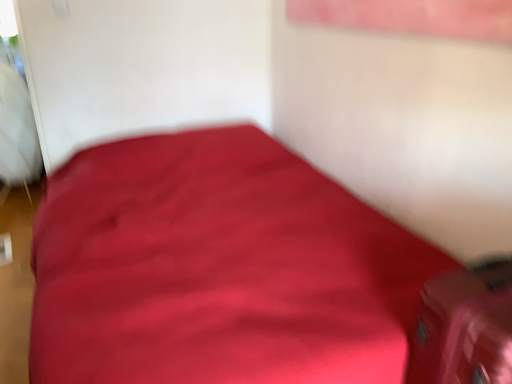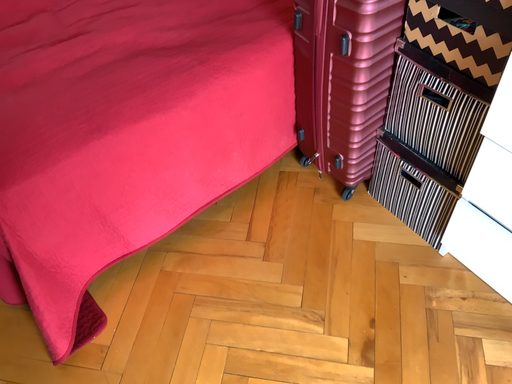
Question: Which way did the camera rotate in the video?

Choices:
 (A) rotated downward
 (B) rotated upward

Answer: (A)